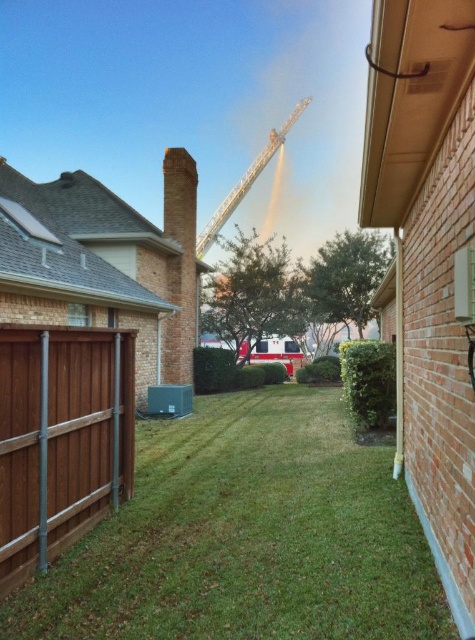
Which is above, brown wood fence at lower left or metallic silver crane at upper center?

metallic silver crane at upper center

Can you confirm if brown wood fence at lower left is taller than metallic silver crane at upper center?

No.

Between point (10, 556) and point (235, 196), which one is positioned in front?

Positioned in front is point (10, 556).

Locate an element on the screen. The width and height of the screenshot is (475, 640). brown wood fence at lower left is located at coordinates (60, 438).

Does green grass at center have a lesser width compared to brick chimney at center?

Incorrect, green grass at center's width is not less than brick chimney at center's.

Does point (358, 593) lie in front of point (176, 154)?

Yes.

Between point (255, 416) and point (177, 273), which one is positioned behind?

The point (177, 273) is more distant.

In order to click on green grass at center in this screenshot , I will do `click(247, 536)`.

Describe the element at coordinates (60, 438) in the screenshot. The width and height of the screenshot is (475, 640). I see `brown wood fence at lower left` at that location.

Between point (94, 515) and point (184, 262), which one is positioned in front?

Positioned in front is point (94, 515).

Is point (117, 362) positioned behind point (178, 170)?

No, (117, 362) is closer to viewer.

Identify the location of brown wood fence at lower left. The width and height of the screenshot is (475, 640). (60, 438).